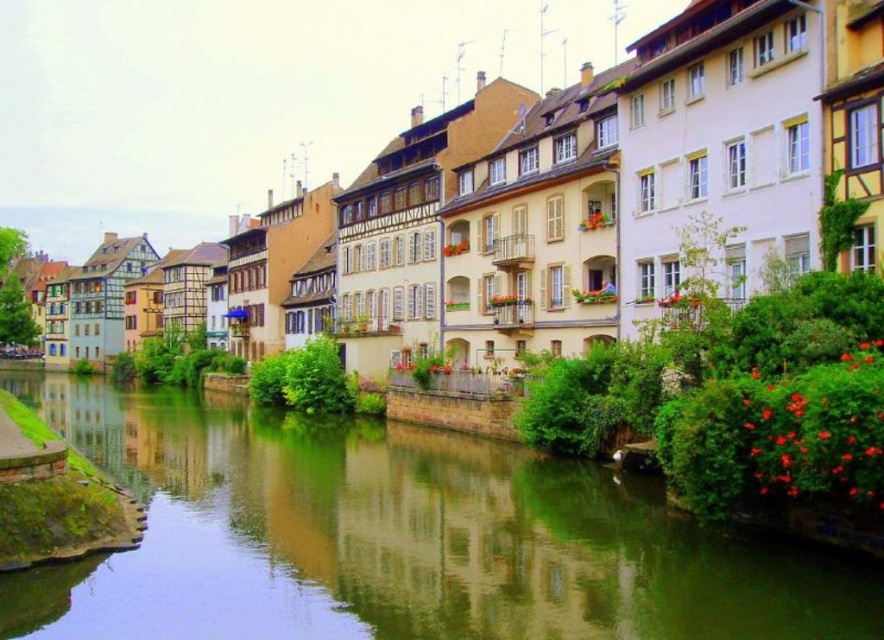
Can you confirm if green stone river at center is positioned below matte beige building at center?

Yes, green stone river at center is below matte beige building at center.

Can you confirm if green stone river at center is positioned to the left of matte beige building at center?

No, green stone river at center is not to the left of matte beige building at center.

Which is in front, point (311, 529) or point (287, 83)?

Point (311, 529) is more forward.

You are a GUI agent. You are given a task and a screenshot of the screen. Output one action in this format:
    pyautogui.click(x=<x>, y=<y>)
    Task: Click on the green stone river at center
    
    Given the screenshot: What is the action you would take?
    pyautogui.click(x=397, y=538)